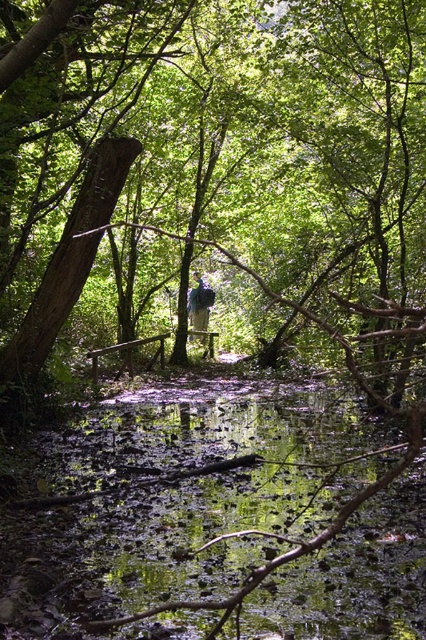
Question: Does smooth brown tree trunk at center appear on the left side of green mossy water at center?

Choices:
 (A) no
 (B) yes

Answer: (A)

Question: Is smooth brown tree trunk at center positioned behind blue fabric backpack at center?

Choices:
 (A) yes
 (B) no

Answer: (B)

Question: Estimate the real-world distances between objects in this image. Which object is closer to the blue fabric backpack at center?

Choices:
 (A) smooth brown tree trunk at center
 (B) green mossy water at center

Answer: (A)

Question: Does green mossy water at center appear over blue fabric backpack at center?

Choices:
 (A) no
 (B) yes

Answer: (A)

Question: Which point is closer to the camera?

Choices:
 (A) green mossy water at center
 (B) smooth brown tree trunk at center

Answer: (A)

Question: Which of these objects is positioned closest to the green mossy water at center?

Choices:
 (A) blue fabric backpack at center
 (B) smooth brown tree trunk at center

Answer: (B)